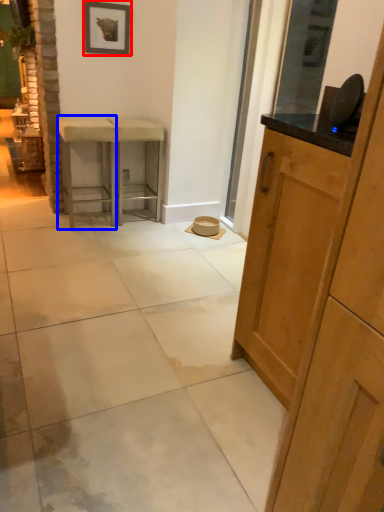
Question: Which point is further to the camera, picture frame (highlighted by a red box) or stool (highlighted by a blue box)?

Choices:
 (A) picture frame
 (B) stool

Answer: (A)